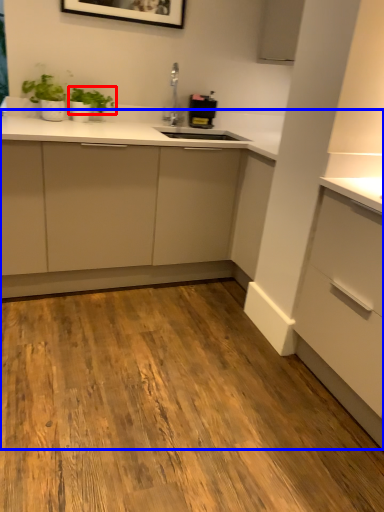
Question: Among these objects, which one is nearest to the camera, plant (highlighted by a red box) or dresser (highlighted by a blue box)?

Choices:
 (A) plant
 (B) dresser

Answer: (B)